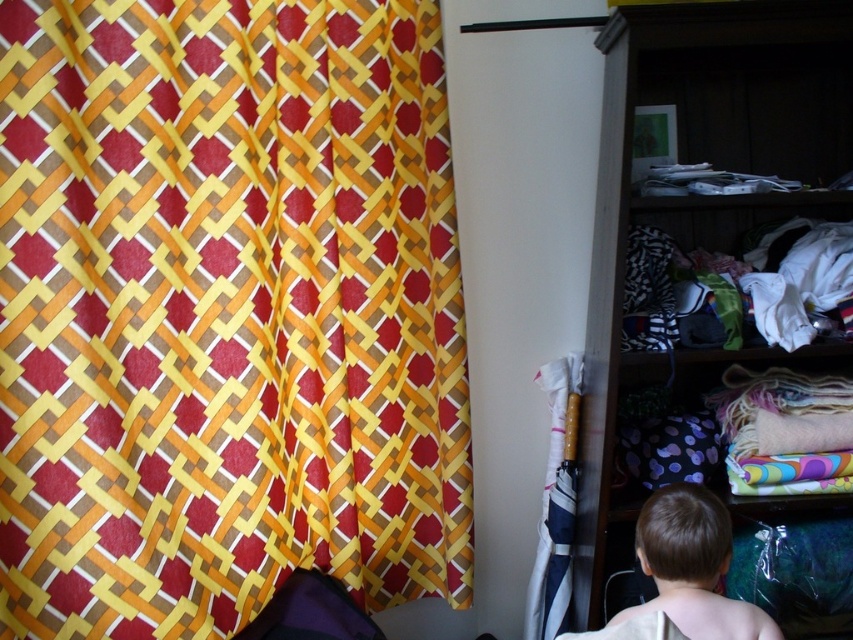
Question: Among these objects, which one is farthest from the camera?

Choices:
 (A) red-yellow woven fabric at left
 (B) light brown hair at lower right

Answer: (B)

Question: Among these points, which one is farthest from the camera?

Choices:
 (A) (131, 464)
 (B) (585, 499)

Answer: (B)

Question: Is red-yellow woven fabric at left positioned before white fabric umbrella at center?

Choices:
 (A) no
 (B) yes

Answer: (B)

Question: Among these points, which one is nearest to the camera?

Choices:
 (A) (612, 400)
 (B) (718, 566)

Answer: (B)

Question: Considering the relative positions of red-yellow woven fabric at left and light brown hair at lower right in the image provided, where is red-yellow woven fabric at left located with respect to light brown hair at lower right?

Choices:
 (A) right
 (B) left

Answer: (B)

Question: Can you confirm if wooden shelves at right is smaller than white fabric umbrella at center?

Choices:
 (A) no
 (B) yes

Answer: (A)